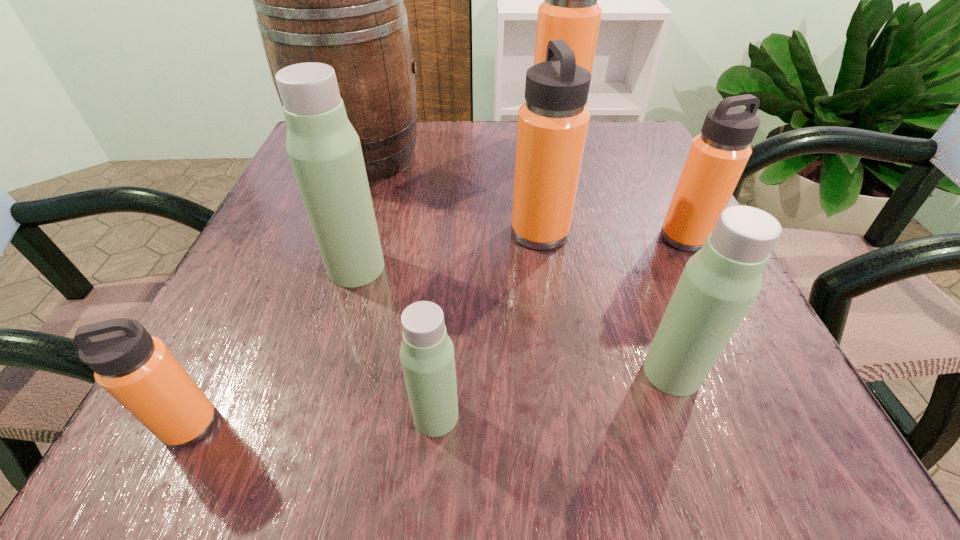
Identify the location of the biggest orange thermos bottle. Image resolution: width=960 pixels, height=540 pixels. (570, 12).

Identify the location of the tallest thermos bottle. This screenshot has width=960, height=540. (570, 12).

Find the location of `cider`. cider is located at coordinates (338, 0).

Where is `the second biggest orange thermos bottle`? The width and height of the screenshot is (960, 540). the second biggest orange thermos bottle is located at coordinates (552, 127).

The image size is (960, 540). I want to click on the second thermos bottle from left to right, so click(324, 150).

This screenshot has height=540, width=960. I want to click on the biggest light thermos bottle, so click(324, 150).

This screenshot has width=960, height=540. I want to click on the rightmost thermos bottle, so click(717, 157).

Identify the location of the rightmost object. This screenshot has width=960, height=540. (717, 157).

I want to click on the second smallest light thermos bottle, so click(x=719, y=283).

Identify the location of the second light thermos bottle from right to left. Image resolution: width=960 pixels, height=540 pixels. (427, 356).